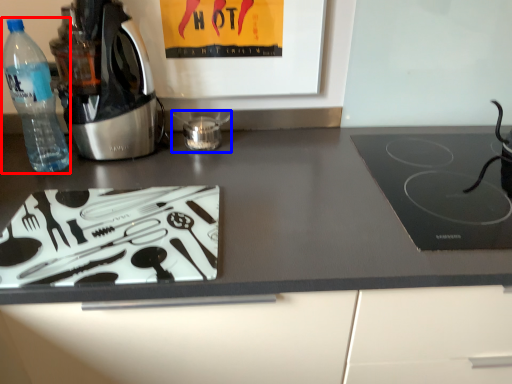
Question: Which of the following is the farthest to the observer, bottle (highlighted by a red box) or appliance (highlighted by a blue box)?

Choices:
 (A) bottle
 (B) appliance

Answer: (B)